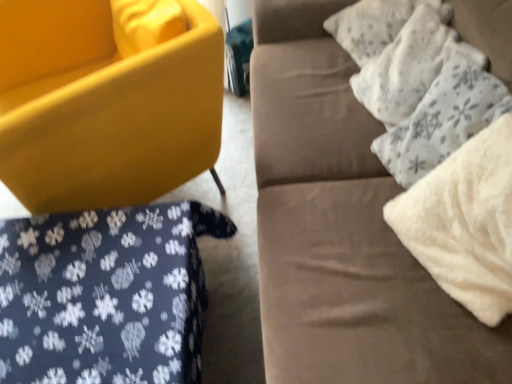
Where is `free spot above dark blue fabric with white snowflake pattern at lower left (from a real-world perspective)`? This screenshot has height=384, width=512. free spot above dark blue fabric with white snowflake pattern at lower left (from a real-world perspective) is located at coordinates (86, 277).